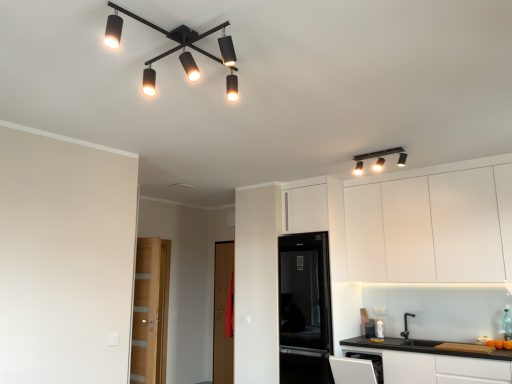
At what (x,y) coordinates should I click in order to perform the action: click on free space above matte black light fixture at upper right (from a real-world perspective). Please return your answer as a coordinate pair (x, y). This screenshot has height=384, width=512. Looking at the image, I should click on (377, 149).